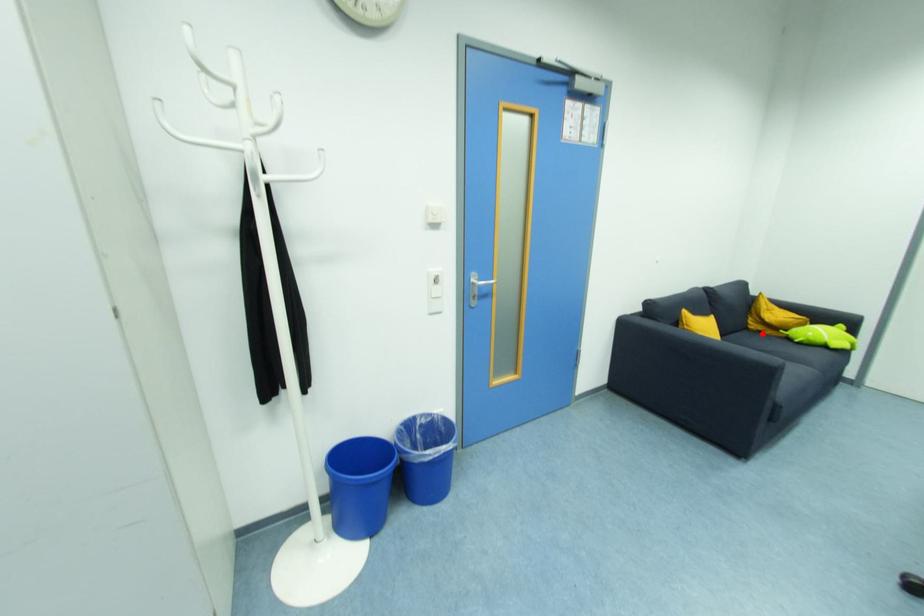
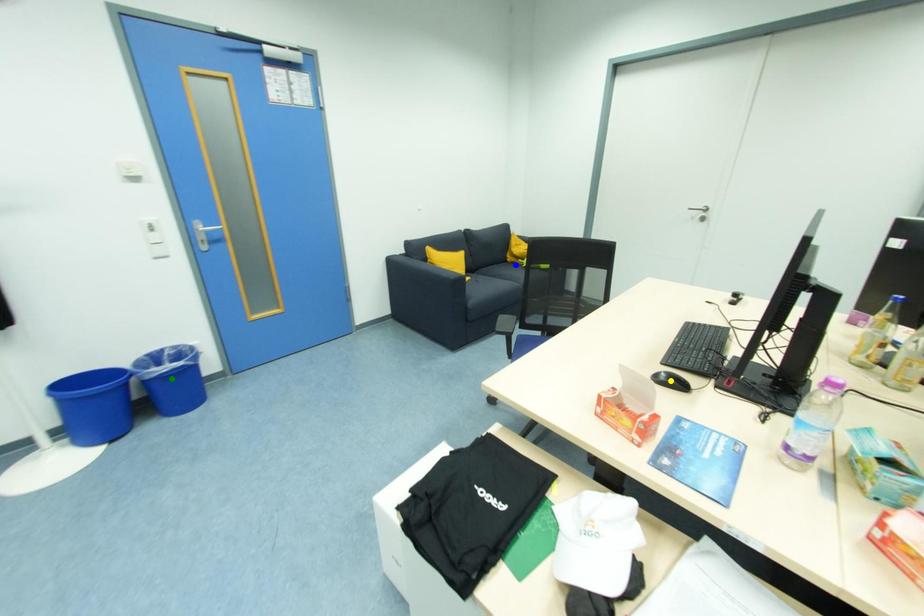
Question: I am providing you with two images of the same scene from different viewpoints. A red point is marked on the first image. You are given multiple points on the second image. Which spot in image 2 lines up with the point in image 1?

Choices:
 (A) green point
 (B) yellow point
 (C) blue point

Answer: (C)